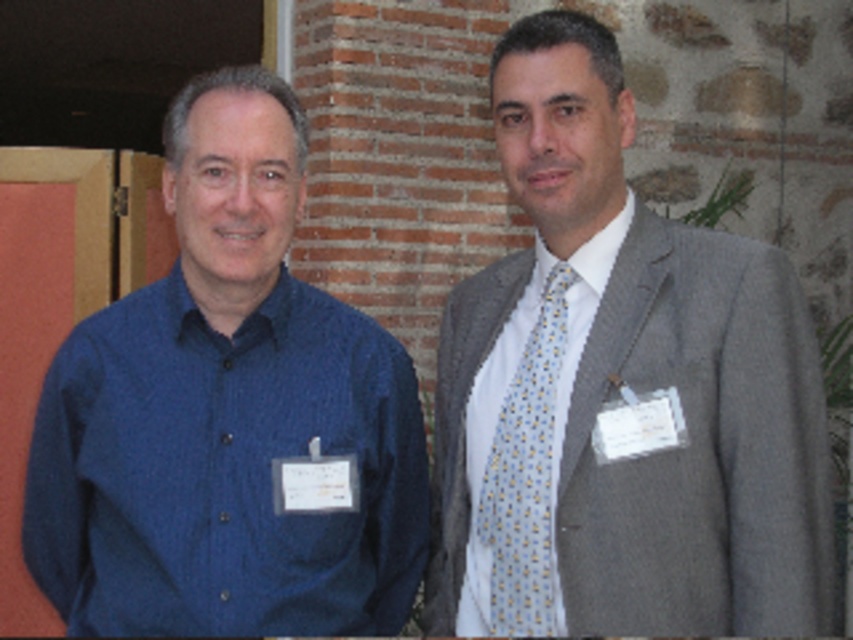
You are standing in front of the two men in the image. The gray textured suit at right is represented by point (614, 387). Which man is wearing the gray textured suit at right?

The man on the right is wearing the gray textured suit at right, as the point (614, 387) corresponds to the gray textured suit at right.

From the picture: You are a photographer setting up for a group photo. You need to ensure that the gray textured suit at right and the light blue silk tie at right are both visible in the frame. Which object should you focus on to ensure both are in focus?

The gray textured suit at right has a greater height compared to the light blue silk tie at right, so focusing on the gray textured suit at right will ensure both are in focus since it is taller and likely further away.